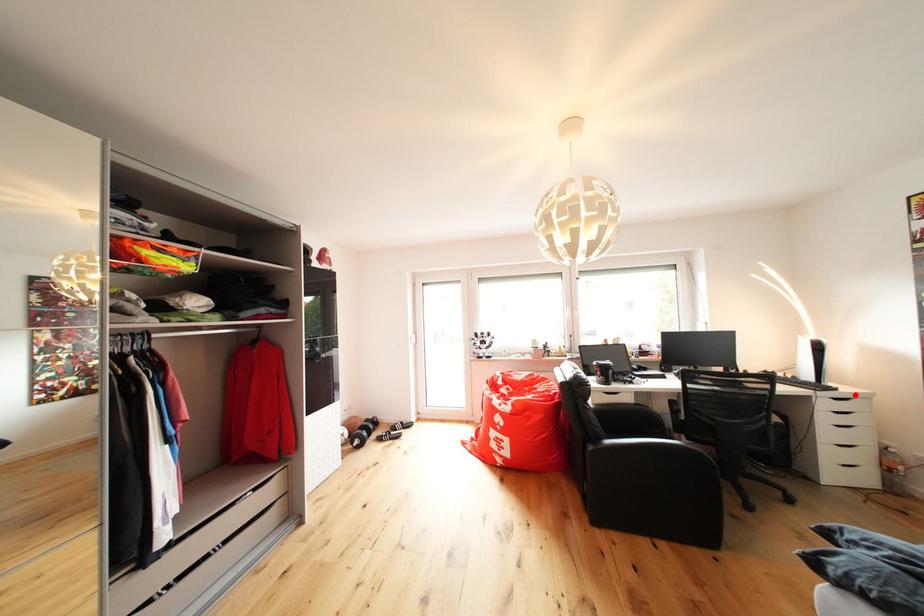
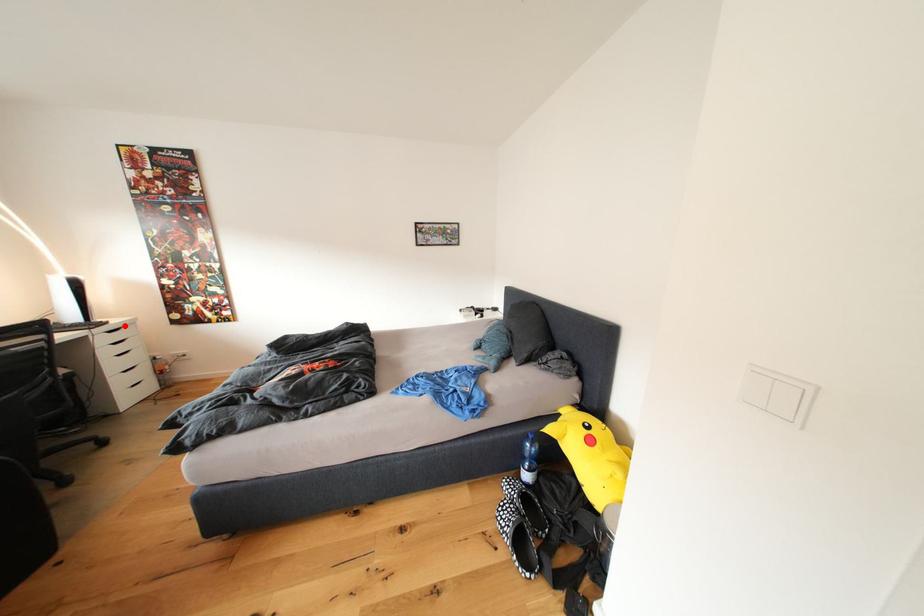
I am providing you with two images of the same scene from different viewpoints. A red point is marked on the first image and another point is marked on the second image. Do the highlighted points in image1 and image2 indicate the same real-world spot?

Yes